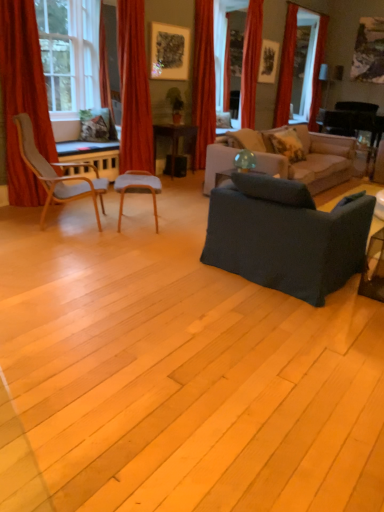
Question: Can you confirm if red velvet curtain at upper right, placed as the fifth curtain when sorted from left to right, is bigger than red velvet curtain at upper center, positioned as the fourth curtain in front-to-back order?

Choices:
 (A) no
 (B) yes

Answer: (A)

Question: Could red velvet curtain at upper center, which is counted as the 3th curtain, starting from the back, be considered to be inside red velvet curtain at upper right, arranged as the fifth curtain when viewed from the front?

Choices:
 (A) yes
 (B) no

Answer: (B)

Question: Could you tell me if red velvet curtain at upper right, positioned as the second curtain in right-to-left order, is turned towards red velvet curtain at upper center, positioned as the fourth curtain in front-to-back order?

Choices:
 (A) no
 (B) yes

Answer: (A)

Question: Is red velvet curtain at upper right, arranged as the fifth curtain when viewed from the front, far away from red velvet curtain at upper center, positioned as the fourth curtain in front-to-back order?

Choices:
 (A) no
 (B) yes

Answer: (A)

Question: Is red velvet curtain at upper right, placed as the fifth curtain when sorted from left to right, facing away from red velvet curtain at upper center, which is counted as the 3th curtain, starting from the back?

Choices:
 (A) no
 (B) yes

Answer: (A)

Question: Is matte gray chair at center, which is the first chair from right to left, inside or outside of red velvet curtain at upper right, marked as the second curtain in a back-to-front arrangement?

Choices:
 (A) outside
 (B) inside

Answer: (A)

Question: From the image's perspective, is matte gray chair at center, which is the first chair from right to left, above or below red velvet curtain at upper right, marked as the second curtain in a back-to-front arrangement?

Choices:
 (A) below
 (B) above

Answer: (A)

Question: Is matte gray chair at center, the 2th chair from the left, bigger or smaller than red velvet curtain at upper right, marked as the second curtain in a back-to-front arrangement?

Choices:
 (A) big
 (B) small

Answer: (B)

Question: Is point (137, 185) positioned closer to the camera than point (289, 36)?

Choices:
 (A) farther
 (B) closer

Answer: (B)

Question: Considering the relative positions of velvet red curtain at upper left, which ranks as the 2th curtain in front-to-back order, and suede beige couch at center, arranged as the second studio couch when viewed from the front, in the image provided, is velvet red curtain at upper left, which ranks as the 2th curtain in front-to-back order, to the left or to the right of suede beige couch at center, arranged as the second studio couch when viewed from the front,?

Choices:
 (A) right
 (B) left

Answer: (B)

Question: From a real-world perspective, is velvet red curtain at upper left, which ranks as the 2th curtain in front-to-back order, physically located above or below suede beige couch at center, the 1th studio couch viewed from the back?

Choices:
 (A) below
 (B) above

Answer: (B)

Question: Is velvet red curtain at upper left, which is the fifth curtain from back to front, inside or outside of suede beige couch at center, arranged as the second studio couch when viewed from the front?

Choices:
 (A) inside
 (B) outside

Answer: (B)

Question: Looking at the image, does velvet red curtain at upper left, placed as the 5th curtain when sorted from right to left, seem bigger or smaller compared to suede beige couch at center, arranged as the second studio couch when viewed from the front?

Choices:
 (A) small
 (B) big

Answer: (A)

Question: Do you think fluffy beige pillow at upper right is within matte gray chair at center, which is the first chair from right to left, or outside of it?

Choices:
 (A) outside
 (B) inside

Answer: (A)

Question: Considering the relative positions of fluffy beige pillow at upper right and matte gray chair at center, the 2th chair from the left, in the image provided, is fluffy beige pillow at upper right to the left or to the right of matte gray chair at center, the 2th chair from the left,?

Choices:
 (A) right
 (B) left

Answer: (A)